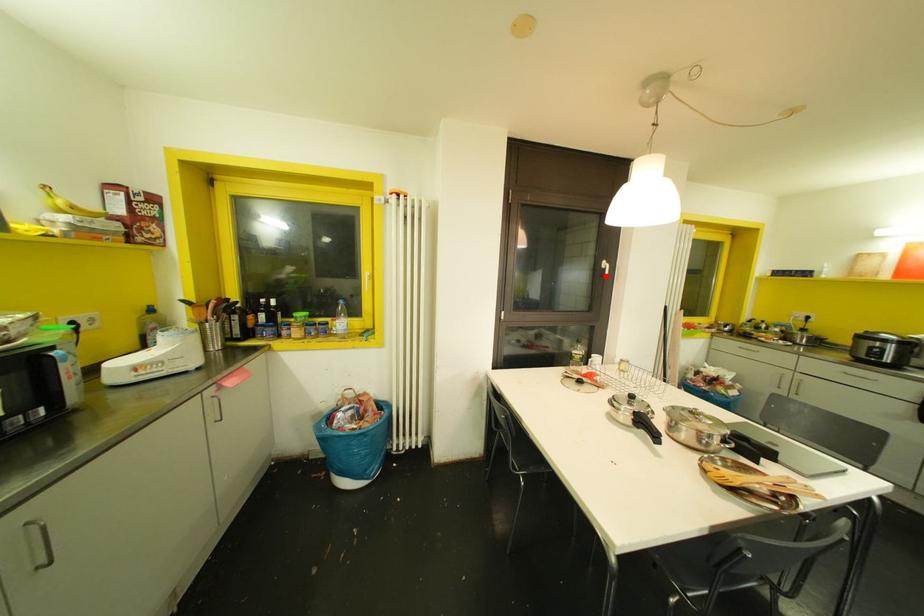
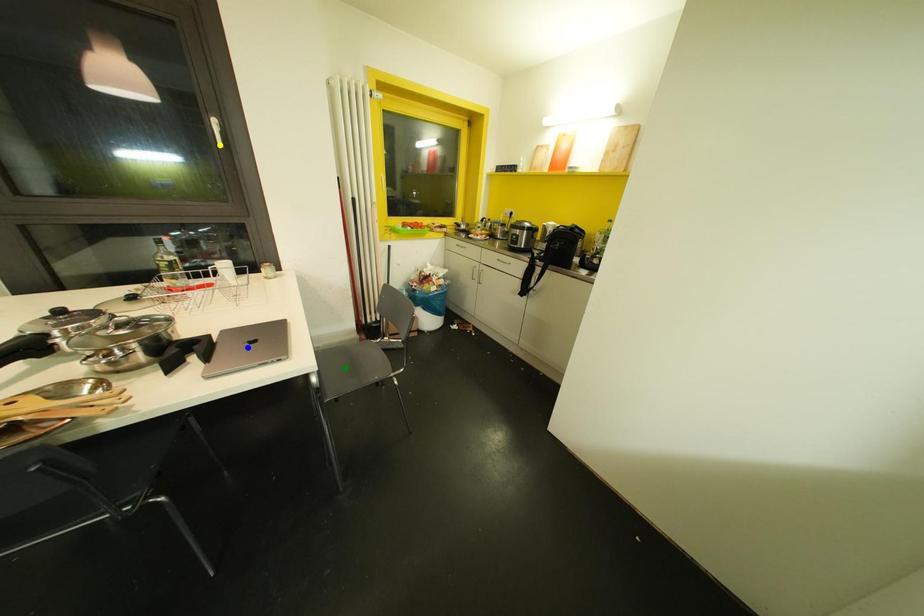
Question: I am providing you with two images of the same scene from different viewpoints. A red point is marked on the first image. You are given multiple points on the second image. In image 2, which mark is for the same physical point as the one in image 1?

Choices:
 (A) blue point
 (B) yellow point
 (C) green point

Answer: (B)